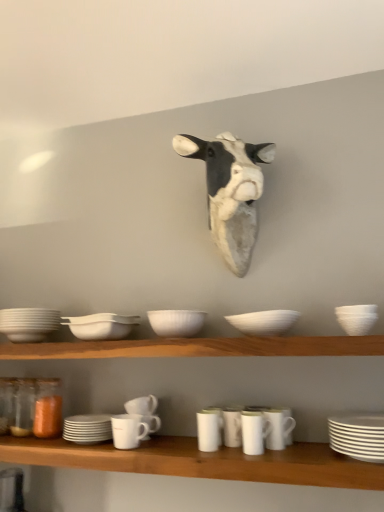
What do you see at coordinates (357, 318) in the screenshot? I see `white matte bowl at upper right, placed as the tenth tableware when sorted from left to right` at bounding box center [357, 318].

What do you see at coordinates (264, 322) in the screenshot?
I see `white matte bowl at center` at bounding box center [264, 322].

This screenshot has width=384, height=512. What do you see at coordinates (87, 428) in the screenshot?
I see `white matte platter at lower left, which appears as the second platter when viewed from the front` at bounding box center [87, 428].

Measure the distance between white matte bowl at center, which is counted as the ninth tableware, starting from the right, and camera.

white matte bowl at center, which is counted as the ninth tableware, starting from the right, is 1.61 meters away from camera.

Where is `white matte cups at lower center`? This screenshot has width=384, height=512. white matte cups at lower center is located at coordinates (201, 461).

Is white glossy mug at center, the 3th tableware from the right, at the right side of white matte bowl at upper right, placed as the tenth tableware when sorted from left to right?

No.

Is white glossy mug at center, which is the 8th tableware in left-to-right order, far away from white matte bowl at upper right, which appears as the 1th tableware when viewed from the right?

No, white glossy mug at center, which is the 8th tableware in left-to-right order, is not far away from white matte bowl at upper right, which appears as the 1th tableware when viewed from the right.

Considering the sizes of white glossy mug at center, which is the 8th tableware in left-to-right order, and white matte bowl at upper right, which appears as the 1th tableware when viewed from the right, in the image, is white glossy mug at center, which is the 8th tableware in left-to-right order, taller or shorter than white matte bowl at upper right, which appears as the 1th tableware when viewed from the right,?

In the image, white glossy mug at center, which is the 8th tableware in left-to-right order, appears to be taller than white matte bowl at upper right, which appears as the 1th tableware when viewed from the right.

Which is correct: white matte mug at center, which appears as the 4th tableware when viewed from the left, is inside white matte platter at lower left, the first platter from the left, or outside of it?

white matte mug at center, which appears as the 4th tableware when viewed from the left, is not inside white matte platter at lower left, the first platter from the left, it's outside.

Is white matte mug at center, the 7th tableware from the right, positioned with its back to white matte platter at lower left, arranged as the 2th platter when viewed from the right?

That's not correct — white matte mug at center, the 7th tableware from the right, is not looking away from white matte platter at lower left, arranged as the 2th platter when viewed from the right.

Which of these two, white matte mug at center, the 7th tableware from the right, or white matte platter at lower left, which ranks as the 1th platter in back-to-front order, stands shorter?

With less height is white matte mug at center, the 7th tableware from the right.

Considering the sizes of white matte mug at center, the 7th tableware from the right, and white matte platter at lower left, arranged as the 2th platter when viewed from the right, in the image, is white matte mug at center, the 7th tableware from the right, bigger or smaller than white matte platter at lower left, arranged as the 2th platter when viewed from the right,?

Considering their sizes, white matte mug at center, the 7th tableware from the right, takes up less space than white matte platter at lower left, arranged as the 2th platter when viewed from the right.

Based on the photo, which object is wider, white matte bowl at left, which is counted as the tenth tableware, starting from the right, or white matte bowl at center, which is counted as the ninth tableware, starting from the right?

white matte bowl at left, which is counted as the tenth tableware, starting from the right.

Looking at this image, is white matte bowl at left, the first tableware when ordered from left to right, completely or partially outside of white matte bowl at center, which is counted as the ninth tableware, starting from the right?

white matte bowl at left, the first tableware when ordered from left to right, is positioned outside white matte bowl at center, which is counted as the ninth tableware, starting from the right.

Find the location of a particular element. This screenshot has height=512, width=384. tableware lying on the left of white matte bowl at center, which is counted as the ninth tableware, starting from the right is located at coordinates (28, 323).

Looking at this image, from the image's perspective, who appears lower, white matte bowl at left, the first tableware when ordered from left to right, or white matte bowl at center, which is counted as the ninth tableware, starting from the right?

white matte bowl at center, which is counted as the ninth tableware, starting from the right, is shown below in the image.

Considering the relative sizes of white matte bowl at center, which is counted as the ninth tableware, starting from the right, and white matte bowl at center in the image provided, is white matte bowl at center, which is counted as the ninth tableware, starting from the right, shorter than white matte bowl at center?

No, white matte bowl at center, which is counted as the ninth tableware, starting from the right, is not shorter than white matte bowl at center.

Based on the photo, do you think white matte bowl at center, which is counted as the ninth tableware, starting from the right, is within white matte bowl at center, or outside of it?

white matte bowl at center, which is counted as the ninth tableware, starting from the right, is not enclosed by white matte bowl at center.

How much distance is there between white matte bowl at center, which is counted as the ninth tableware, starting from the right, and white matte bowl at center?

20.30 inches.

Is white matte bowl at center, which is counted as the ninth tableware, starting from the right, aimed at white matte bowl at center?

No, white matte bowl at center, which is counted as the ninth tableware, starting from the right, is not facing towards white matte bowl at center.

Is white matte cow head at center thinner than white glossy mug at center, which appears as the seventh tableware when viewed from the left?

No.

Between white matte cow head at center and white glossy mug at center, which appears as the seventh tableware when viewed from the left, which one has smaller size?

white glossy mug at center, which appears as the seventh tableware when viewed from the left.

Can you confirm if white matte cow head at center is positioned to the left of white glossy mug at center, which appears as the seventh tableware when viewed from the left?

Indeed, white matte cow head at center is positioned on the left side of white glossy mug at center, which appears as the seventh tableware when viewed from the left.

Is white matte platter at lower right, the 1th platter viewed from the front, bigger or smaller than wooden shelf at center?

white matte platter at lower right, the 1th platter viewed from the front, is smaller than wooden shelf at center.

Which object is positioned more to the right, white matte platter at lower right, the 1th platter viewed from the front, or wooden shelf at center?

From the viewer's perspective, white matte platter at lower right, the 1th platter viewed from the front, appears more on the right side.

From a real-world perspective, is white matte platter at lower right, the 1th platter viewed from the front, above or below wooden shelf at center?

From a real-world perspective, white matte platter at lower right, the 1th platter viewed from the front, is physically below wooden shelf at center.

Does white matte platter at lower right, which is counted as the 2th platter, starting from the back, turn towards wooden shelf at center?

No, white matte platter at lower right, which is counted as the 2th platter, starting from the back, is not aimed at wooden shelf at center.

In the scene shown: Measure the distance from white glossy mug at lower center, acting as the ninth tableware starting from the left, to translucent orange glass jar at lower left.

white glossy mug at lower center, acting as the ninth tableware starting from the left, and translucent orange glass jar at lower left are 35.39 inches apart.

Which is closer to the camera, (292, 418) or (38, 434)?

Point (292, 418) is positioned closer to the camera compared to point (38, 434).

Could you tell me if white glossy mug at lower center, acting as the ninth tableware starting from the left, is facing translucent orange glass jar at lower left?

No, white glossy mug at lower center, acting as the ninth tableware starting from the left, does not turn towards translucent orange glass jar at lower left.

Would you say white glossy mug at lower center, arranged as the 2th tableware when viewed from the right, is inside or outside translucent orange glass jar at lower left?

white glossy mug at lower center, arranged as the 2th tableware when viewed from the right, is not enclosed by translucent orange glass jar at lower left.

Locate an element on the screen. This screenshot has height=512, width=384. the 4th tableware below the white matte bowl at upper right, which appears as the 1th tableware when viewed from the right (from the image's perspective) is located at coordinates (254, 432).

From a real-world perspective, which platter is the 2nd one underneath the white matte mug at center, the 7th tableware from the right? Please provide its 2D coordinates.

[(87, 428)]

Based on the photo, based on their spatial positions, is translucent orange glass jar at lower left or white matte bowl at center, the second tableware positioned from the left, closer to white matte bowl at center?

white matte bowl at center, the second tableware positioned from the left.

Estimate the real-world distances between objects in this image. Which object is further from white glossy mug at lower center, arranged as the 2th tableware when viewed from the right, translucent orange glass jar at lower left or white matte mug at lower center, marked as the eighth tableware in a right-to-left arrangement?

translucent orange glass jar at lower left is further to white glossy mug at lower center, arranged as the 2th tableware when viewed from the right.

When comparing their distances from white matte mug at lower center, the sixth tableware from the right, does white matte platter at lower right, the 1th platter viewed from the front, or white matte mug at center, the 7th tableware from the right, seem closer?

white matte mug at center, the 7th tableware from the right, is positioned closer to the anchor white matte mug at lower center, the sixth tableware from the right.

Which object lies nearer to the anchor point white glossy mug at lower center, acting as the ninth tableware starting from the left, white matte bowl at center or translucent orange glass jar at lower left?

white matte bowl at center is closer to white glossy mug at lower center, acting as the ninth tableware starting from the left.

From the image, which object appears to be farther from white matte platter at lower left, which appears as the second platter when viewed from the front, white matte bowl at center or white matte bowl at upper right, placed as the tenth tableware when sorted from left to right?

white matte bowl at upper right, placed as the tenth tableware when sorted from left to right, is positioned further to the anchor white matte platter at lower left, which appears as the second platter when viewed from the front.

From the image, which object appears to be farther from white glossy mug at center, the 3th tableware from the right, white matte cup at center, positioned as the 5th tableware in right-to-left order, or white matte bowl at center, the second tableware positioned from the left?

white matte bowl at center, the second tableware positioned from the left, is further to white glossy mug at center, the 3th tableware from the right.

Which object lies nearer to the anchor point white matte cup at center, positioned as the 5th tableware in right-to-left order, white matte platter at lower right, which is counted as the 2th platter, starting from the back, or white matte cups at lower center?

Among the two, white matte cups at lower center is located nearer to white matte cup at center, positioned as the 5th tableware in right-to-left order.

Based on the photo, based on their spatial positions, is white glossy mug at lower center, acting as the ninth tableware starting from the left, or white matte cups at lower center closer to white matte mug at center, the 7th tableware from the right?

Among the two, white matte cups at lower center is located nearer to white matte mug at center, the 7th tableware from the right.

Identify the location of platter between white matte bowl at left, the first tableware when ordered from left to right, and white matte cups at lower center. This screenshot has width=384, height=512. (87, 428).

Where is `shelf between white matte cow head at center and white glossy mug at center, the 3th tableware from the right, from top to bottom`? This screenshot has width=384, height=512. shelf between white matte cow head at center and white glossy mug at center, the 3th tableware from the right, from top to bottom is located at coordinates (198, 347).

Locate an element on the screen. The height and width of the screenshot is (512, 384). shelf located between translucent orange glass jar at lower left and white matte platter at lower right, which is counted as the 2th platter, starting from the back, in the left-right direction is located at coordinates (198, 347).

Locate an element on the screen. This screenshot has width=384, height=512. bowl between white matte bowl at upper right, placed as the tenth tableware when sorted from left to right, and white glossy mug at center, which is the 8th tableware in left-to-right order, in the vertical direction is located at coordinates (264, 322).